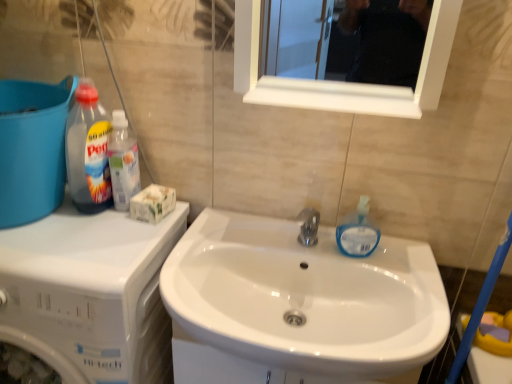
What are the coordinates of `white glossy dishwasher at left` in the screenshot? It's located at (89, 294).

Locate an element on the screen. Image resolution: width=512 pixels, height=384 pixels. translucent blue liquid soap at sink right, acting as the 3th cleaning product starting from the left is located at coordinates (358, 232).

Considering the sizes of objects translucent plastic bottle at upper left, the second cleaning product from the left, and translucent blue liquid soap at sink right, acting as the 3th cleaning product starting from the left, in the image provided, who is taller, translucent plastic bottle at upper left, the second cleaning product from the left, or translucent blue liquid soap at sink right, acting as the 3th cleaning product starting from the left,?

translucent plastic bottle at upper left, the second cleaning product from the left.

From the image's perspective, is translucent plastic bottle at upper left, the second cleaning product positioned from the right, located beneath translucent blue liquid soap at sink right, the 1th cleaning product positioned from the right?

No, from the image's perspective, translucent plastic bottle at upper left, the second cleaning product positioned from the right, is not below translucent blue liquid soap at sink right, the 1th cleaning product positioned from the right.

Are translucent plastic bottle at upper left, the second cleaning product from the left, and translucent blue liquid soap at sink right, acting as the 3th cleaning product starting from the left, far apart?

No, there isn't a large distance between translucent plastic bottle at upper left, the second cleaning product from the left, and translucent blue liquid soap at sink right, acting as the 3th cleaning product starting from the left.

Can you tell me how much translucent plastic bottle at upper left, the second cleaning product positioned from the right, and translucent blue liquid soap at sink right, the 1th cleaning product positioned from the right, differ in facing direction?

7.57 degrees separate the facing orientations of translucent plastic bottle at upper left, the second cleaning product positioned from the right, and translucent blue liquid soap at sink right, the 1th cleaning product positioned from the right.

Which object is positioned more to the left, translucent plastic bottle at upper left, the second cleaning product from the left, or white glossy dishwasher at left?

white glossy dishwasher at left.

Does translucent plastic bottle at upper left, the second cleaning product positioned from the right, turn towards white glossy dishwasher at left?

No, translucent plastic bottle at upper left, the second cleaning product positioned from the right, is not turned towards white glossy dishwasher at left.

From a real-world perspective, does translucent plastic bottle at upper left, the second cleaning product from the left, sit lower than white glossy dishwasher at left?

Actually, translucent plastic bottle at upper left, the second cleaning product from the left, is physically above white glossy dishwasher at left in the real world.

Find the location of `dish washer to the left of translucent plastic bottle at upper left, the second cleaning product positioned from the right`. dish washer to the left of translucent plastic bottle at upper left, the second cleaning product positioned from the right is located at coordinates (89, 294).

Is transparent plastic bottle at left, acting as the third cleaning product starting from the right, smaller than white glossy sink at center?

Yes, transparent plastic bottle at left, acting as the third cleaning product starting from the right, is smaller than white glossy sink at center.

Considering the sizes of objects transparent plastic bottle at left, acting as the third cleaning product starting from the right, and white glossy sink at center in the image provided, who is shorter, transparent plastic bottle at left, acting as the third cleaning product starting from the right, or white glossy sink at center?

white glossy sink at center is shorter.

Considering the positions of objects transparent plastic bottle at left, which ranks as the 1th cleaning product in left-to-right order, and white glossy sink at center in the image provided, who is in front, transparent plastic bottle at left, which ranks as the 1th cleaning product in left-to-right order, or white glossy sink at center?

white glossy sink at center.

Does transparent plastic bottle at left, acting as the third cleaning product starting from the right, turn towards white glossy sink at center?

No, transparent plastic bottle at left, acting as the third cleaning product starting from the right, is not aimed at white glossy sink at center.

Considering the points (362, 213) and (35, 137), which point is behind, point (362, 213) or point (35, 137)?

Point (362, 213)

Is translucent blue liquid soap at sink right, the 1th cleaning product positioned from the right, not near blue plastic bucket at left?

No.

Between translucent blue liquid soap at sink right, acting as the 3th cleaning product starting from the left, and blue plastic bucket at left, which one appears on the right side from the viewer's perspective?

translucent blue liquid soap at sink right, acting as the 3th cleaning product starting from the left.

Could you tell me if translucent blue liquid soap at sink right, acting as the 3th cleaning product starting from the left, is facing blue plastic bucket at left?

No, translucent blue liquid soap at sink right, acting as the 3th cleaning product starting from the left, is not turned towards blue plastic bucket at left.

From a real-world perspective, which is physically below, blue plastic bucket at left or translucent blue liquid soap at sink right, acting as the 3th cleaning product starting from the left?

From a 3D spatial view, translucent blue liquid soap at sink right, acting as the 3th cleaning product starting from the left, is below.

Is point (53, 166) closer to camera compared to point (361, 208)?

Yes, it is.

From the image's perspective, between blue plastic bucket at left and translucent blue liquid soap at sink right, the 1th cleaning product positioned from the right, who is located below?

translucent blue liquid soap at sink right, the 1th cleaning product positioned from the right.

Who is taller, blue plastic bucket at left or white glossy sink at center?

blue plastic bucket at left.

Is blue plastic bucket at left directly adjacent to white glossy sink at center?

No, blue plastic bucket at left is not making contact with white glossy sink at center.

Is blue plastic bucket at left wider or thinner than white glossy sink at center?

In the image, blue plastic bucket at left appears to be more narrow than white glossy sink at center.

Is blue plastic bucket at left not inside white glossy sink at center?

Yes, blue plastic bucket at left is outside of white glossy sink at center.

Considering the sizes of objects white glossy sink at center and blue plastic bucket at left in the image provided, who is shorter, white glossy sink at center or blue plastic bucket at left?

Standing shorter between the two is white glossy sink at center.

Image resolution: width=512 pixels, height=384 pixels. In order to click on water tank behind the white glossy sink at center in this screenshot , I will do `click(32, 148)`.

Is white glossy sink at center not inside blue plastic bucket at left?

Yes, white glossy sink at center is located beyond the bounds of blue plastic bucket at left.

Where is `the 1st cleaning product in front when counting from the translucent plastic bottle at upper left, the second cleaning product positioned from the right`? This screenshot has width=512, height=384. the 1st cleaning product in front when counting from the translucent plastic bottle at upper left, the second cleaning product positioned from the right is located at coordinates (358, 232).

Locate an element on the screen. This screenshot has height=384, width=512. dish washer lying on the left of translucent plastic bottle at upper left, the second cleaning product from the left is located at coordinates (89, 294).

Considering their positions, is white glossy sink at center positioned closer to translucent blue liquid soap at sink right, acting as the 3th cleaning product starting from the left, than white glossy dishwasher at left?

white glossy sink at center lies closer to translucent blue liquid soap at sink right, acting as the 3th cleaning product starting from the left, than the other object.

Which object lies further to the anchor point translucent plastic bottle at upper left, the second cleaning product positioned from the right, white glossy dishwasher at left or blue plastic bucket at left?

The object further to translucent plastic bottle at upper left, the second cleaning product positioned from the right, is white glossy dishwasher at left.

Looking at the image, which one is located closer to white glossy sink at center, transparent plastic bottle at left, which ranks as the 1th cleaning product in left-to-right order, or white glossy dishwasher at left?

white glossy dishwasher at left lies closer to white glossy sink at center than the other object.

Based on their spatial positions, is white glossy dishwasher at left or translucent blue liquid soap at sink right, acting as the 3th cleaning product starting from the left, closer to transparent plastic bottle at left, acting as the third cleaning product starting from the right?

white glossy dishwasher at left is closer to transparent plastic bottle at left, acting as the third cleaning product starting from the right.

Consider the image. Looking at the image, which one is located closer to white glossy sink at center, blue plastic bucket at left or white glossy dishwasher at left?

Based on the image, white glossy dishwasher at left appears to be nearer to white glossy sink at center.

Which object lies nearer to the anchor point white glossy dishwasher at left, transparent plastic bottle at left, which ranks as the 1th cleaning product in left-to-right order, or white glossy sink at center?

transparent plastic bottle at left, which ranks as the 1th cleaning product in left-to-right order, is positioned closer to the anchor white glossy dishwasher at left.

When comparing their distances from translucent plastic bottle at upper left, the second cleaning product positioned from the right, does blue plastic bucket at left or white glossy sink at center seem closer?

Based on the image, blue plastic bucket at left appears to be nearer to translucent plastic bottle at upper left, the second cleaning product positioned from the right.

Looking at the image, which one is located further to translucent plastic bottle at upper left, the second cleaning product from the left, blue plastic bucket at left or white glossy dishwasher at left?

white glossy dishwasher at left lies further to translucent plastic bottle at upper left, the second cleaning product from the left, than the other object.

Where is `cleaning product between transparent plastic bottle at left, acting as the third cleaning product starting from the right, and white glossy sink at center, in the horizontal direction`? cleaning product between transparent plastic bottle at left, acting as the third cleaning product starting from the right, and white glossy sink at center, in the horizontal direction is located at coordinates (123, 162).

You are a GUI agent. You are given a task and a screenshot of the screen. Output one action in this format:
    pyautogui.click(x=<x>, y=<y>)
    Task: Click on the sink between white glossy dishwasher at left and translucent blue liquid soap at sink right, the 1th cleaning product positioned from the right, from left to right
    This screenshot has height=384, width=512.
    Given the screenshot: What is the action you would take?
    pyautogui.click(x=297, y=305)

I want to click on cleaning product located between transparent plastic bottle at left, acting as the third cleaning product starting from the right, and translucent blue liquid soap at sink right, the 1th cleaning product positioned from the right, in the left-right direction, so click(123, 162).

You are a GUI agent. You are given a task and a screenshot of the screen. Output one action in this format:
    pyautogui.click(x=<x>, y=<y>)
    Task: Click on the dish washer between blue plastic bucket at left and white glossy sink at center
    The width and height of the screenshot is (512, 384).
    Given the screenshot: What is the action you would take?
    pyautogui.click(x=89, y=294)